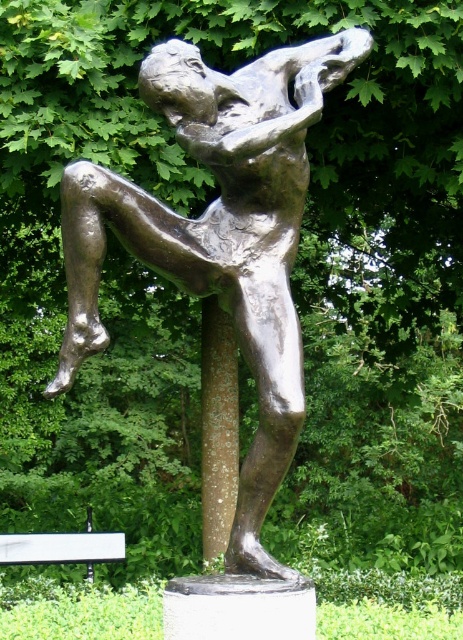
Can you confirm if bronze statue at center is thinner than white plastic bench at lower left?

In fact, bronze statue at center might be wider than white plastic bench at lower left.

Locate an element on the screen. The image size is (463, 640). bronze statue at center is located at coordinates (219, 236).

Who is more distant from viewer, (x=236, y=557) or (x=118, y=540)?

Positioned behind is point (x=118, y=540).

Where is `bronze statue at center`? The width and height of the screenshot is (463, 640). bronze statue at center is located at coordinates (219, 236).